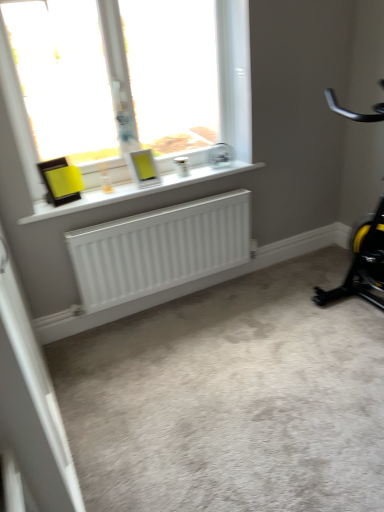
Question: Considering the relative positions of white matte screen door at lower left and white matte radiator at lower center in the image provided, is white matte screen door at lower left to the right of white matte radiator at lower center from the viewer's perspective?

Choices:
 (A) yes
 (B) no

Answer: (B)

Question: Can you confirm if white matte screen door at lower left is taller than white matte radiator at lower center?

Choices:
 (A) no
 (B) yes

Answer: (B)

Question: Considering the relative sizes of white matte screen door at lower left and white matte radiator at lower center in the image provided, is white matte screen door at lower left thinner than white matte radiator at lower center?

Choices:
 (A) no
 (B) yes

Answer: (B)

Question: From the image's perspective, is white matte screen door at lower left on white matte radiator at lower center?

Choices:
 (A) no
 (B) yes

Answer: (A)

Question: Could white matte radiator at lower center be considered to be inside white matte screen door at lower left?

Choices:
 (A) no
 (B) yes

Answer: (A)

Question: Is white plastic window at upper center to the left or to the right of white matte radiator at lower center in the image?

Choices:
 (A) right
 (B) left

Answer: (B)

Question: Considering the positions of point (200, 48) and point (165, 189), is point (200, 48) closer or farther from the camera than point (165, 189)?

Choices:
 (A) farther
 (B) closer

Answer: (A)

Question: Looking at their shapes, would you say white plastic window at upper center is wider or thinner than white matte radiator at lower center?

Choices:
 (A) wide
 (B) thin

Answer: (B)

Question: From a real-world perspective, is white plastic window at upper center physically located above or below white matte radiator at lower center?

Choices:
 (A) above
 (B) below

Answer: (A)

Question: Is white matte screen door at lower left in front of or behind white matte radiator at lower center in the image?

Choices:
 (A) behind
 (B) front

Answer: (B)

Question: In the image, is white matte screen door at lower left on the left side or the right side of white matte radiator at lower center?

Choices:
 (A) right
 (B) left

Answer: (B)

Question: Based on their sizes in the image, would you say white matte screen door at lower left is bigger or smaller than white matte radiator at lower center?

Choices:
 (A) small
 (B) big

Answer: (A)

Question: From a real-world perspective, is white matte screen door at lower left positioned above or below white matte radiator at lower center?

Choices:
 (A) above
 (B) below

Answer: (B)

Question: From the image's perspective, relative to black/yellow plastic stationary bicycle at right, is white matte radiator at lower center above or below?

Choices:
 (A) below
 (B) above

Answer: (B)

Question: Looking at their shapes, would you say white matte radiator at lower center is wider or thinner than black/yellow plastic stationary bicycle at right?

Choices:
 (A) thin
 (B) wide

Answer: (A)